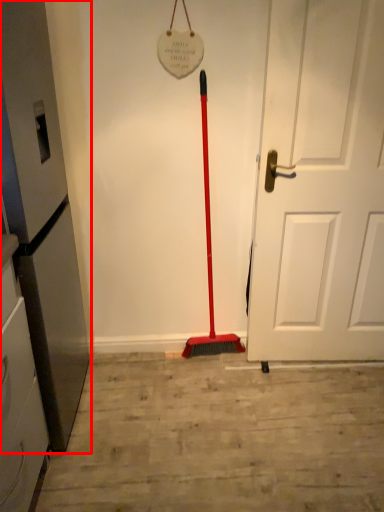
Question: Where is appliance (annotated by the red box) located in relation to door in the image?

Choices:
 (A) right
 (B) left

Answer: (B)